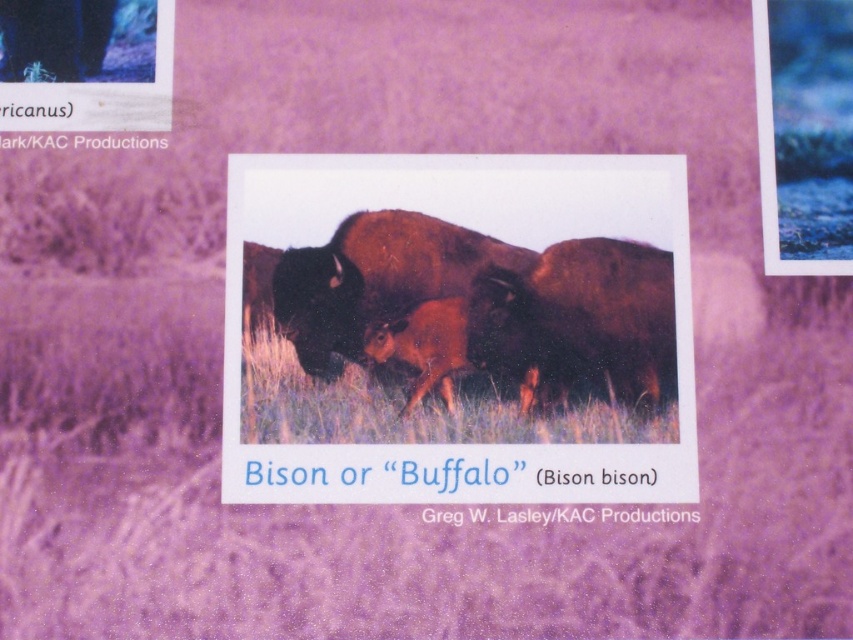
Between brown fur bison at center and brown fuzzy bison at center, which one is positioned lower?

brown fur bison at center

Does brown fur bison at center have a lesser width compared to brown fuzzy bison at center?

No.

Who is more forward, (548, 216) or (410, 298)?

Positioned in front is point (410, 298).

The image size is (853, 640). Identify the location of brown fur bison at center. (483, 232).